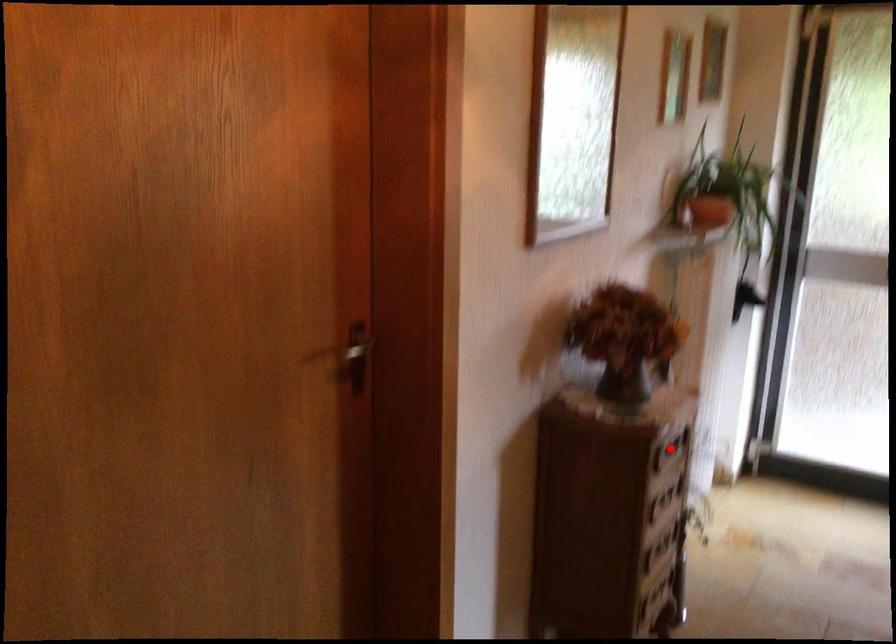
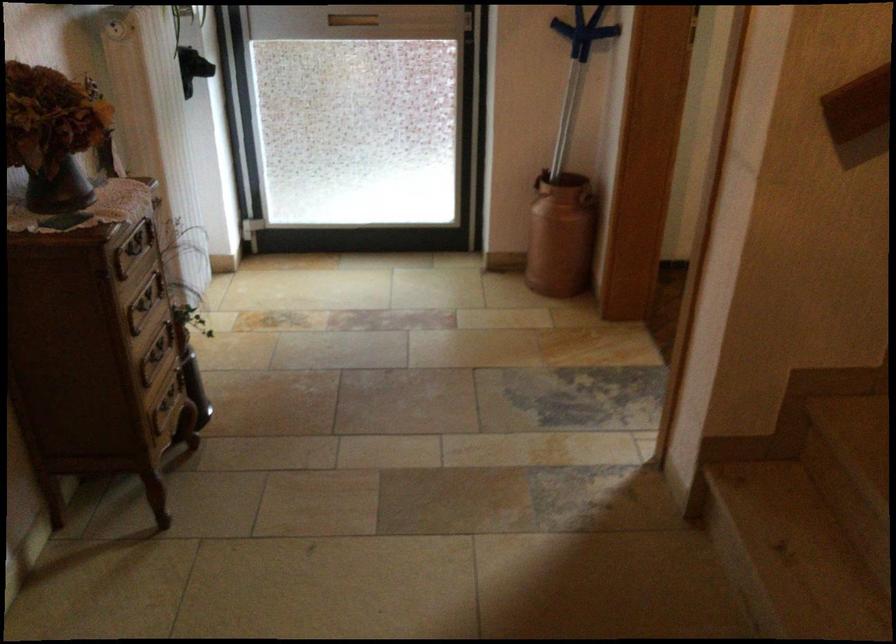
Where in the second image is the point corresponding to the highlighted location from the first image?

(133, 248)